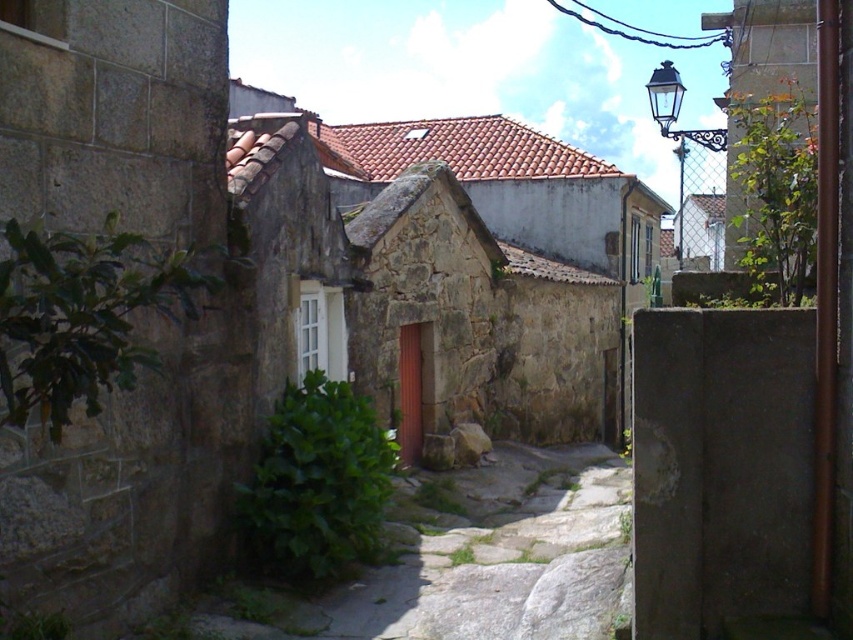
Question: Is green mossy stone path at center closer to camera compared to black wrought iron streetlight at upper right?

Choices:
 (A) no
 (B) yes

Answer: (B)

Question: Which point is farther from the camera taking this photo?

Choices:
 (A) (666, 97)
 (B) (544, 456)

Answer: (B)

Question: In this image, where is green mossy stone path at center located relative to black wrought iron streetlight at upper right?

Choices:
 (A) below
 (B) above

Answer: (A)

Question: Which object is farther from the camera taking this photo?

Choices:
 (A) green mossy stone path at center
 (B) black wrought iron streetlight at upper right

Answer: (B)

Question: From the image, what is the correct spatial relationship of green mossy stone path at center in relation to black wrought iron streetlight at upper right?

Choices:
 (A) below
 (B) above

Answer: (A)